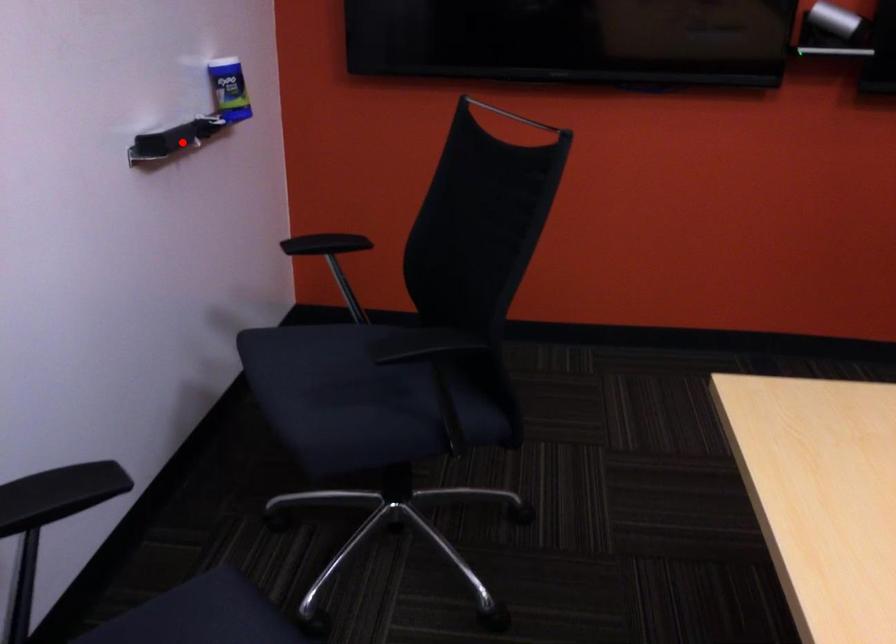
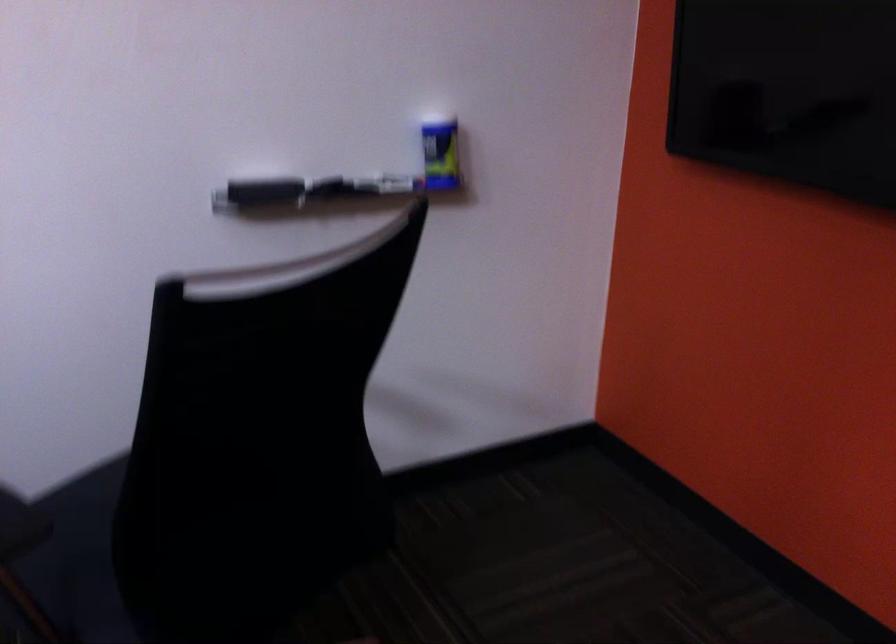
Question: I am providing you with two images of the same scene from different viewpoints. Given a red point in image1, look at the same physical point in image2. Is it:

Choices:
 (A) Closer to the viewpoint
 (B) Farther from the viewpoint

Answer: (A)